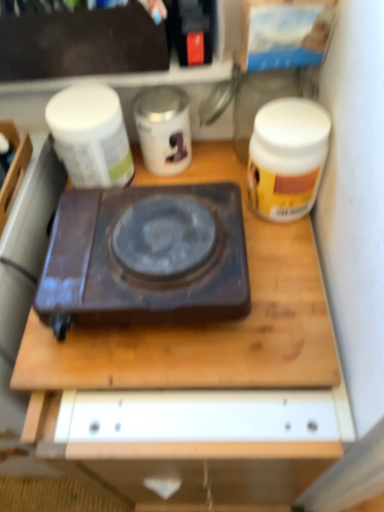
Locate an element on the screen. The image size is (384, 512). vacant space situated above dark brown plastic gas stove at center (from a real-world perspective) is located at coordinates (155, 240).